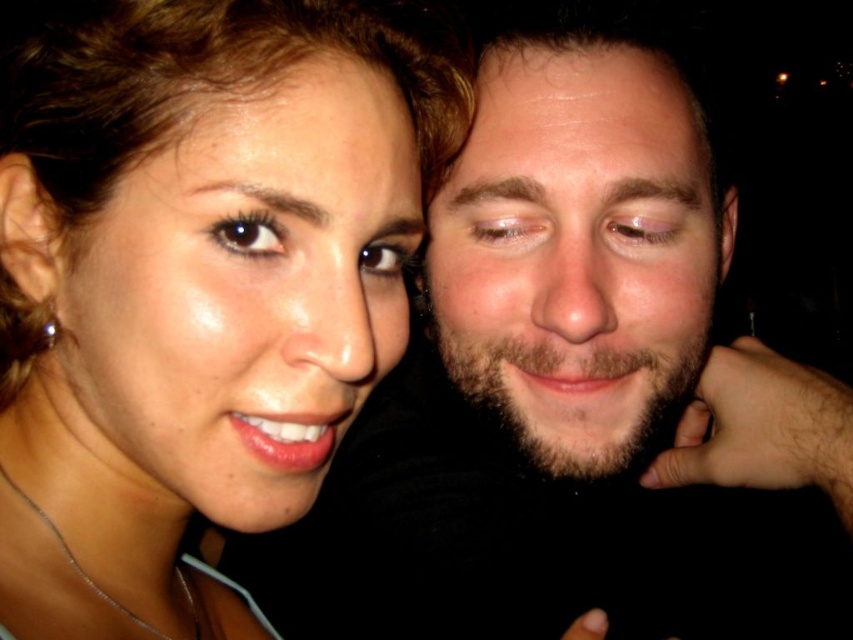
Question: Which point is farther to the camera?

Choices:
 (A) dry skin forehead at upper center
 (B) bearded face at right
 (C) brown glossy eye at upper left

Answer: (A)

Question: Is brown glossy eye at upper left to the left of brown matte eyebrow at upper center from the viewer's perspective?

Choices:
 (A) no
 (B) yes

Answer: (B)

Question: Does smooth black shirt at center lie in front of matte skin face at left?

Choices:
 (A) no
 (B) yes

Answer: (A)

Question: Which of the following is the farthest from the observer?

Choices:
 (A) dark brown hair at upper center
 (B) bearded face at right

Answer: (A)

Question: Among these objects, which one is farthest from the camera?

Choices:
 (A) brown matte eye at center
 (B) brownhaireyebrow at upper center

Answer: (A)

Question: Is the position of pink matte eye at center less distant than that of brown hair at upper center?

Choices:
 (A) yes
 (B) no

Answer: (B)